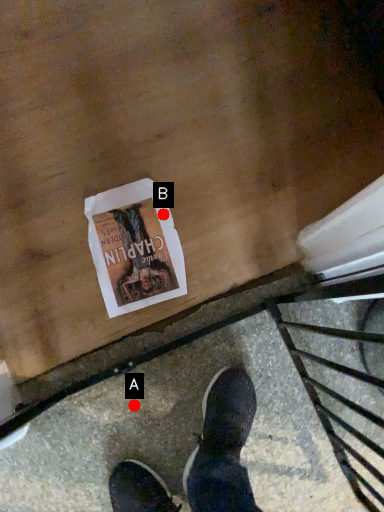
Question: Two points are circled on the image, labeled by A and B beside each circle. Which point is closer to the camera?

Choices:
 (A) A is closer
 (B) B is closer

Answer: (A)